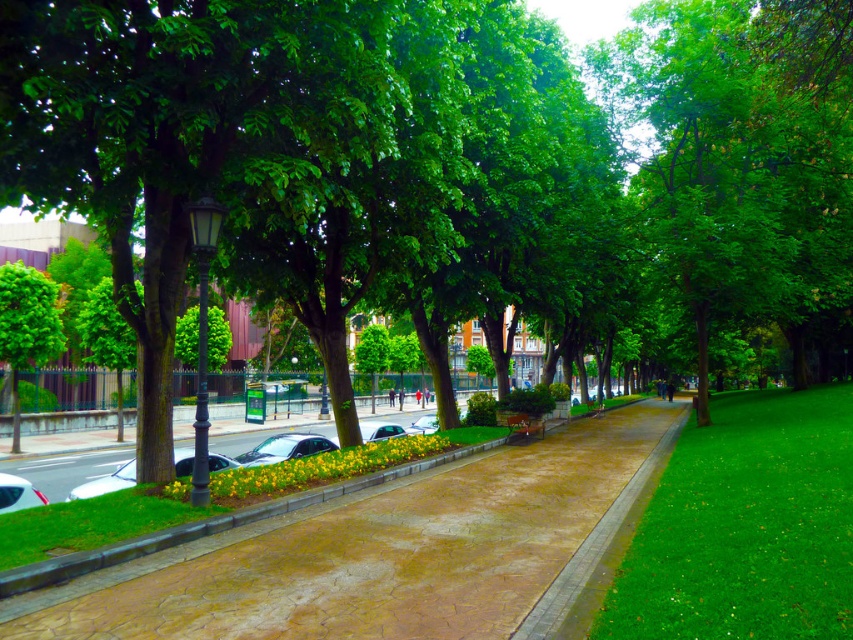
Question: Based on their relative distances, which object is nearer to the green leafy tree at left?

Choices:
 (A) green grass at right
 (B) white glossy car at lower left
 (C) shiny black car at center

Answer: (C)

Question: Can you confirm if brown textured pavement at center is wider than green grass at right?

Choices:
 (A) no
 (B) yes

Answer: (A)

Question: Among these points, which one is farthest from the camera?

Choices:
 (A) (131, 634)
 (B) (606, 566)

Answer: (B)

Question: Can you confirm if green grass at right is thinner than shiny silver car at lower left?

Choices:
 (A) no
 (B) yes

Answer: (A)

Question: Does brown concrete curb at center appear on the left side of green leafy tree at left?

Choices:
 (A) yes
 (B) no

Answer: (B)

Question: Among these points, which one is farthest from the camera?

Choices:
 (A) (634, 600)
 (B) (0, 316)
 (C) (622, 428)

Answer: (C)